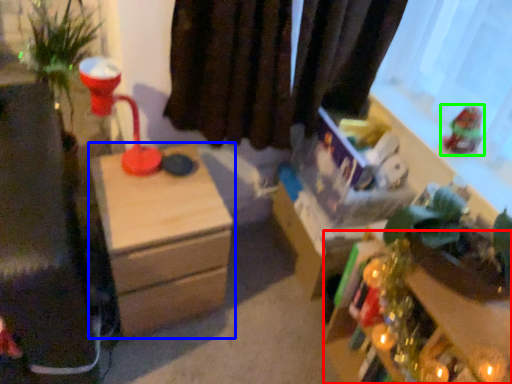
Question: Which object is positioned closest to table (highlighted by a red box)? Select from nightstand (highlighted by a blue box) and toy (highlighted by a green box).

Choices:
 (A) nightstand
 (B) toy

Answer: (B)